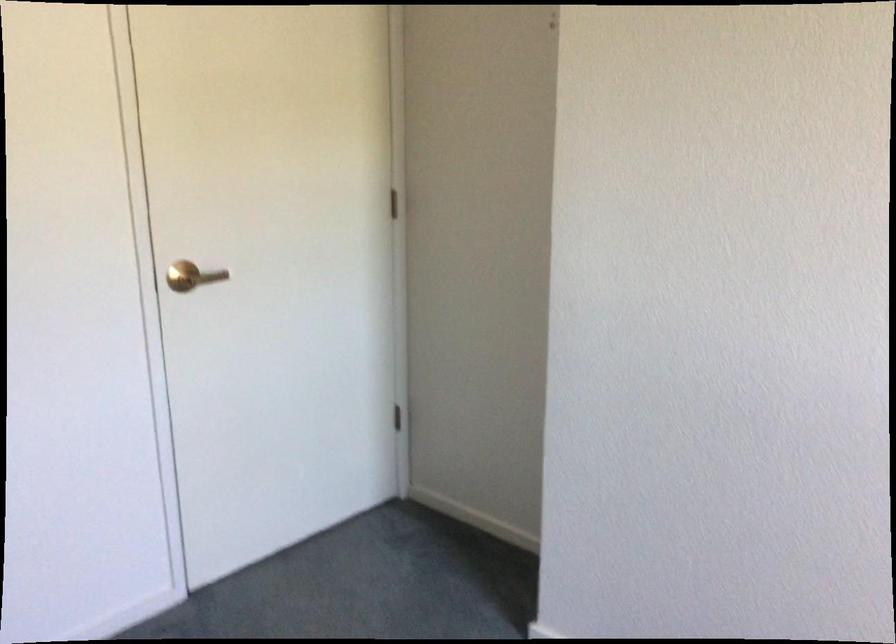
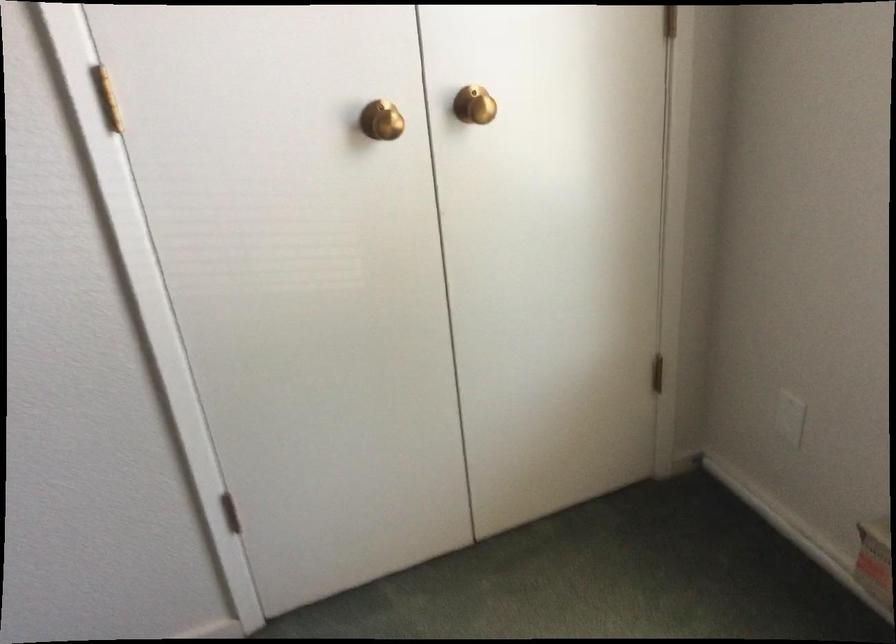
The first image is from the beginning of the video and the second image is from the end. How did the camera likely rotate when shooting the video?

The camera rotated toward right-down.